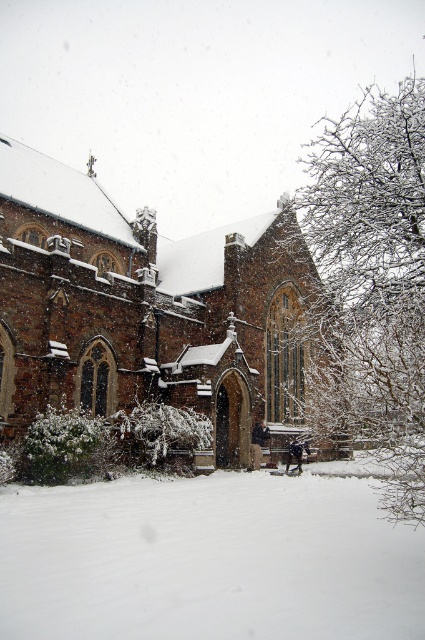
Is point (198, 346) positioned in front of point (113, 595)?

No, it is behind (113, 595).

At what (x,y) coordinates should I click in order to perform the action: click on brown stone church at center. Please return your answer as a coordinate pair (x, y). The height and width of the screenshot is (640, 425). Looking at the image, I should click on (144, 307).

Find the location of a particular element. brown stone church at center is located at coordinates (144, 307).